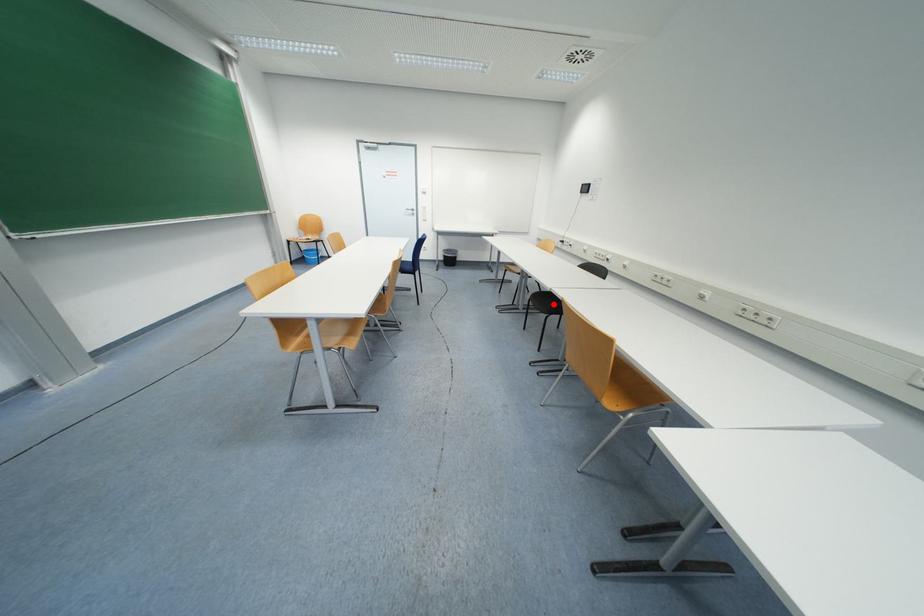
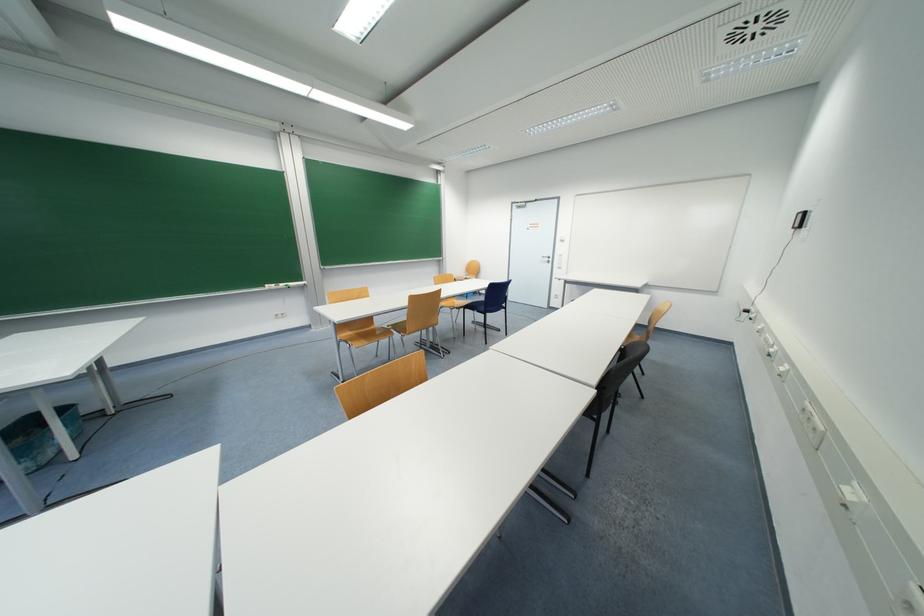
Question: I am providing you with two images of the same scene from different viewpoints. A red point is marked on the first image. At the location where the point appears in image 1, is it still visible in image 2?

Choices:
 (A) Yes
 (B) No

Answer: (B)